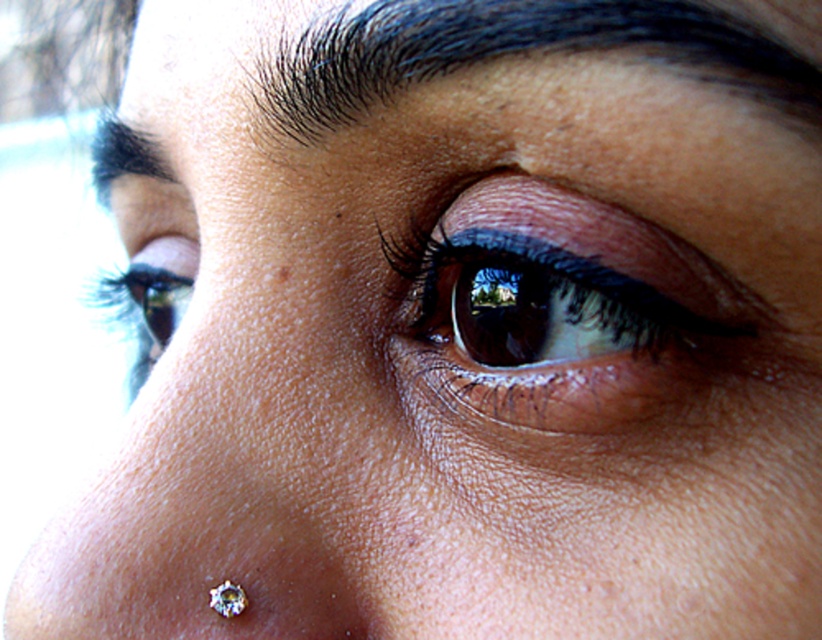
Does dark brown hair at upper left have a larger size compared to clear crystal earring at lower center?

Correct, dark brown hair at upper left is larger in size than clear crystal earring at lower center.

Looking at this image, which is more to the right, dark brown hair at upper left or clear crystal earring at lower center?

From the viewer's perspective, clear crystal earring at lower center appears more on the right side.

The height and width of the screenshot is (640, 822). Identify the location of dark brown hair at upper left. (123, 156).

Between point (160, 273) and point (169, 173), which one is positioned in front?

Positioned in front is point (169, 173).

At what (x,y) coordinates should I click in order to perform the action: click on matte black eye at upper left. Please return your answer as a coordinate pair (x, y). This screenshot has width=822, height=640. Looking at the image, I should click on (151, 298).

Is point (654, 371) closer to camera compared to point (647, 17)?

No, it is behind (647, 17).

Is point (539, 401) positioned behind point (506, 17)?

Yes, point (539, 401) is farther from viewer.

Between point (442, 396) and point (612, 19), which one is positioned in front?

Positioned in front is point (612, 19).

Find the location of a particular element. brown matte eye at center is located at coordinates (566, 310).